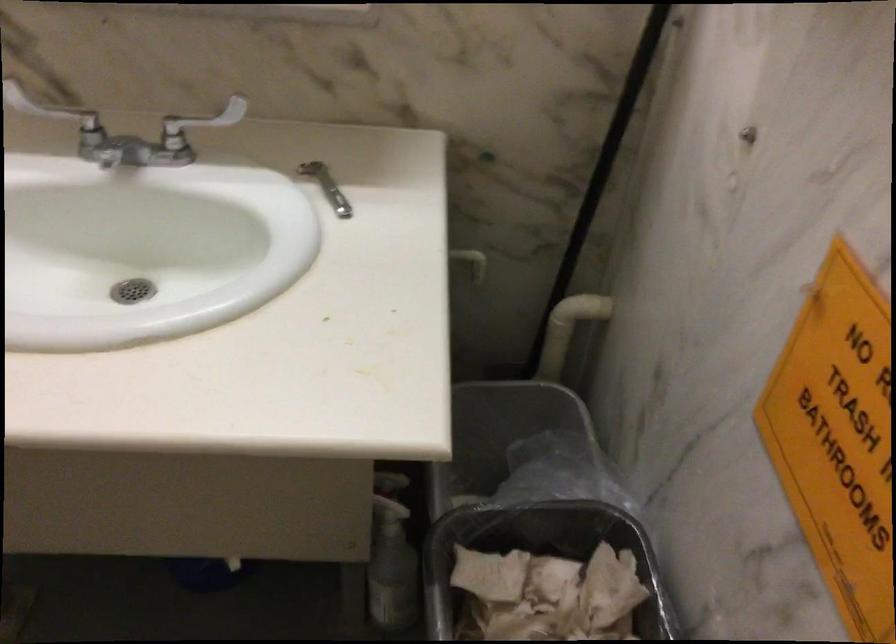
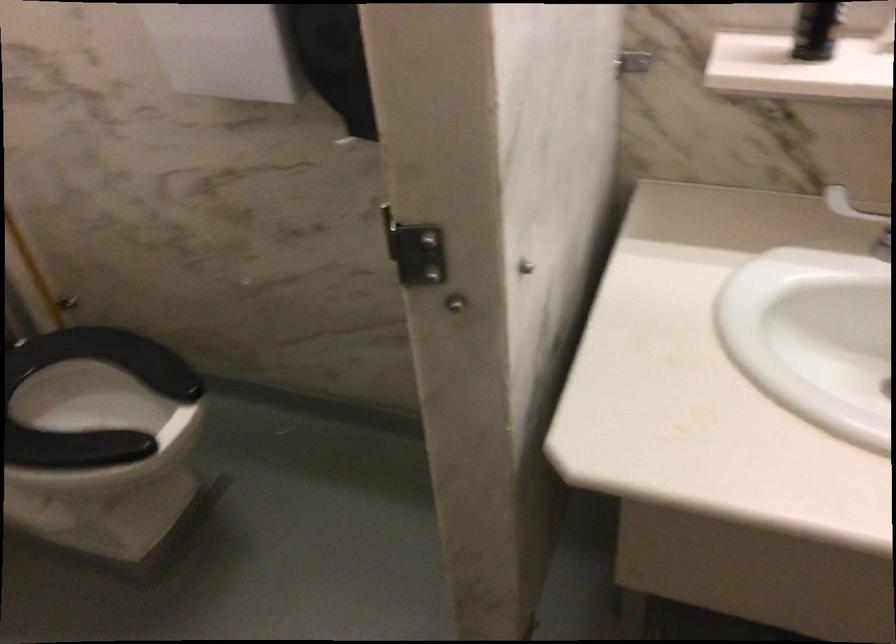
Question: What movement of the cameraman would produce the second image?

Choices:
 (A) Left
 (B) Right
 (C) Forward
 (D) Backward

Answer: (A)